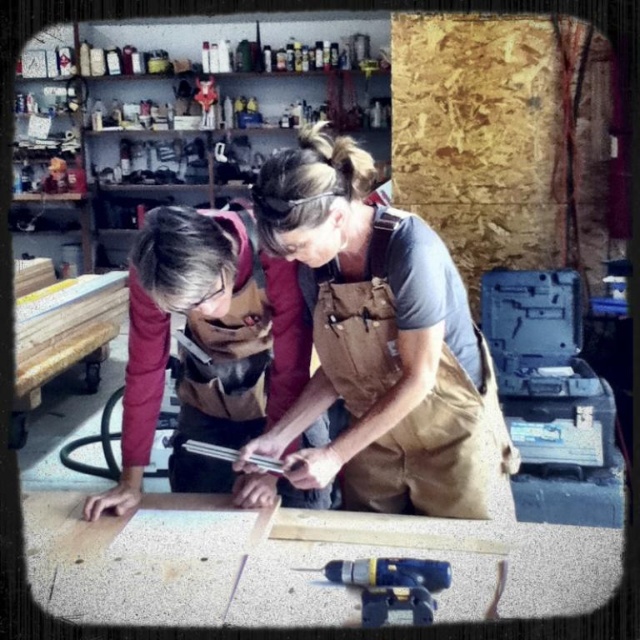
You are trying to decide which apron to wear for a messy project. The brown canvas apron at center and the matte brown apron at center are available. Based on their width, which one would you choose?

The brown canvas apron at center is wider than the matte brown apron at center, so you should choose the brown canvas apron at center for better coverage during a messy project.

You are organizing tools in a workshop and need to place the brown canvas apron at center and the yellow plastic drill at lower center. According to their positions, which object should you move first to the right side of the workbench?

The brown canvas apron at center should be moved first to the right side of the workbench because it is currently to the left of the yellow plastic drill at lower center, so moving it first would allow the drill to be positioned correctly afterward.